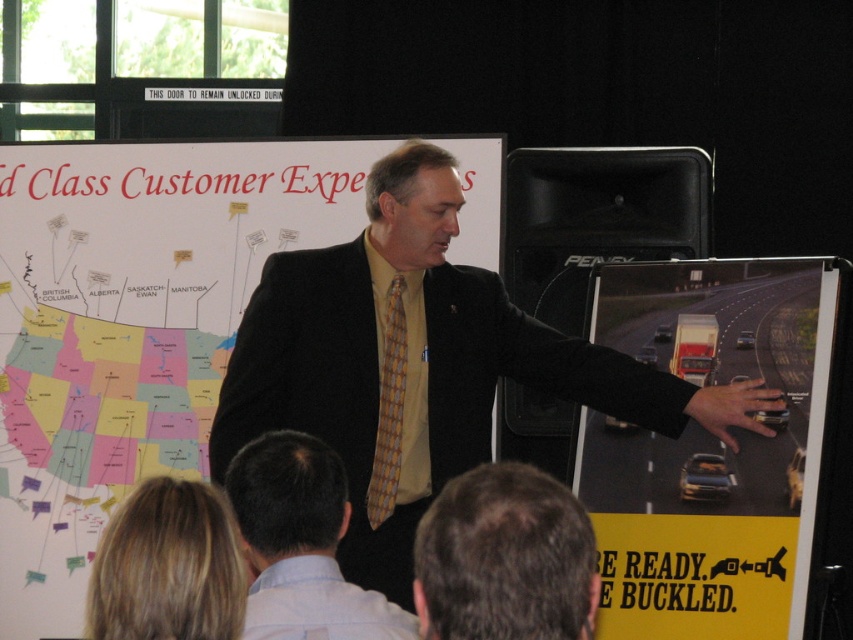
Does white paperboard at upper left lie in front of yellow tie at center?

No, it is behind yellow tie at center.

The image size is (853, 640). I want to click on white paperboard at upper left, so click(x=131, y=326).

Is matte black suit at center behind dark brown hair at lower center?

Yes, matte black suit at center is behind dark brown hair at lower center.

Does matte black suit at center have a larger size compared to dark brown hair at lower center?

Yes.

Image resolution: width=853 pixels, height=640 pixels. Identify the location of matte black suit at center. (425, 385).

Between dark brown hair at lower center and yellow tie at center, which one is positioned lower?

yellow tie at center is lower down.

Who is higher up, dark brown hair at lower center or yellow tie at center?

Positioned higher is dark brown hair at lower center.

Identify the location of dark brown hair at lower center. (505, 557).